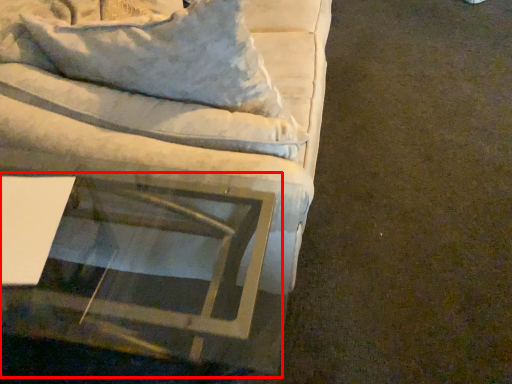
Question: Considering the relative positions of round table (annotated by the red box) and studio couch in the image provided, where is round table (annotated by the red box) located with respect to the staircase?

Choices:
 (A) left
 (B) right

Answer: (A)